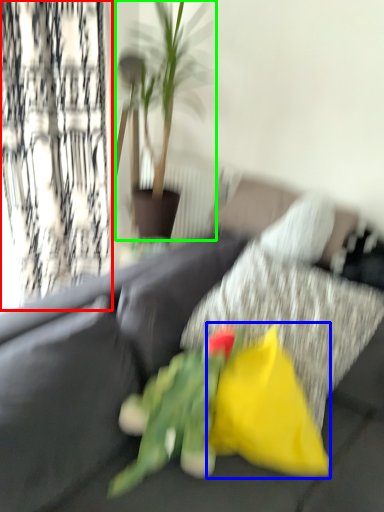
Question: Considering the real-world distances, which object is farthest from curtain (highlighted by a red box)? flower (highlighted by a blue box) or houseplant (highlighted by a green box)?

Choices:
 (A) flower
 (B) houseplant

Answer: (A)